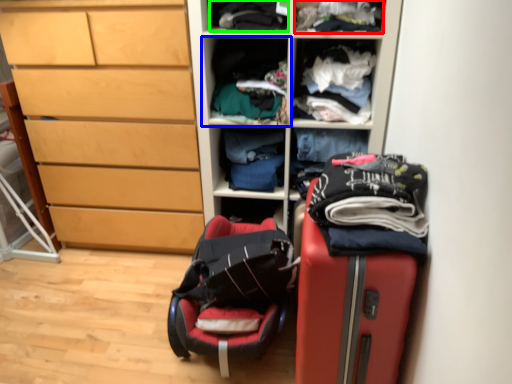
Question: Which is farther away from clothing (highlighted by a red box)? shelf (highlighted by a blue box) or clothing (highlighted by a green box)?

Choices:
 (A) shelf
 (B) clothing

Answer: (A)